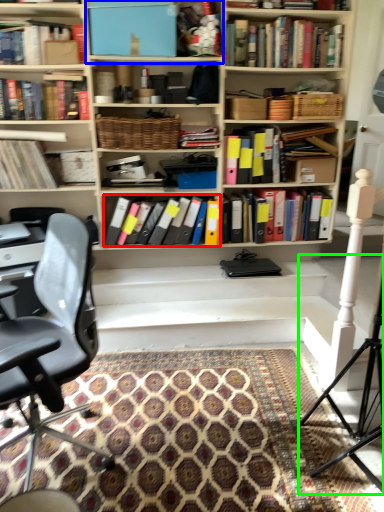
Question: Which object is the farthest from book (highlighted by a red box)? Choose among these: cabinet (highlighted by a blue box) or tripod (highlighted by a green box).

Choices:
 (A) cabinet
 (B) tripod

Answer: (B)